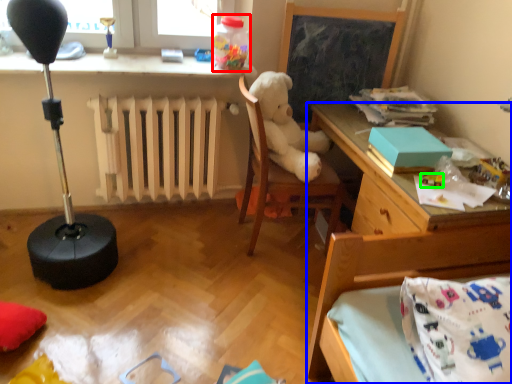
Question: Considering the real-world distances, which object is closest to toy (highlighted by a red box)? desk (highlighted by a blue box) or toy (highlighted by a green box).

Choices:
 (A) desk
 (B) toy

Answer: (A)